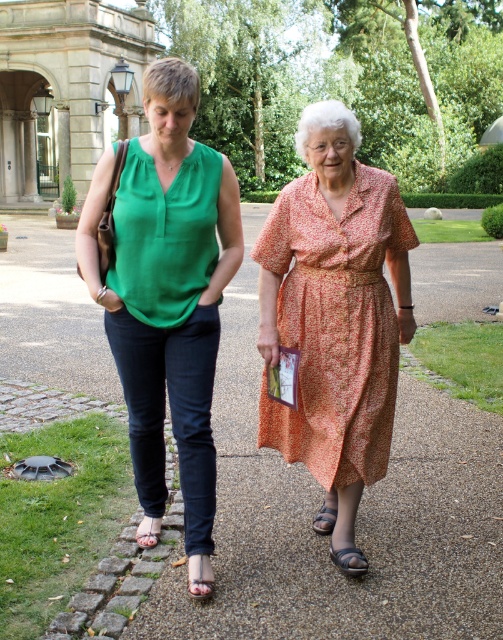
You are a gardener planning to plant a row of flowers along the edge of the brown gravel pavement at center and the printed cotton dress at center. Which object should you place the flowers closer to based on their widths?

The printed cotton dress at center is narrower than the brown gravel pavement at center, so you should place the flowers closer to the printed cotton dress at center to ensure they fit within the available space.